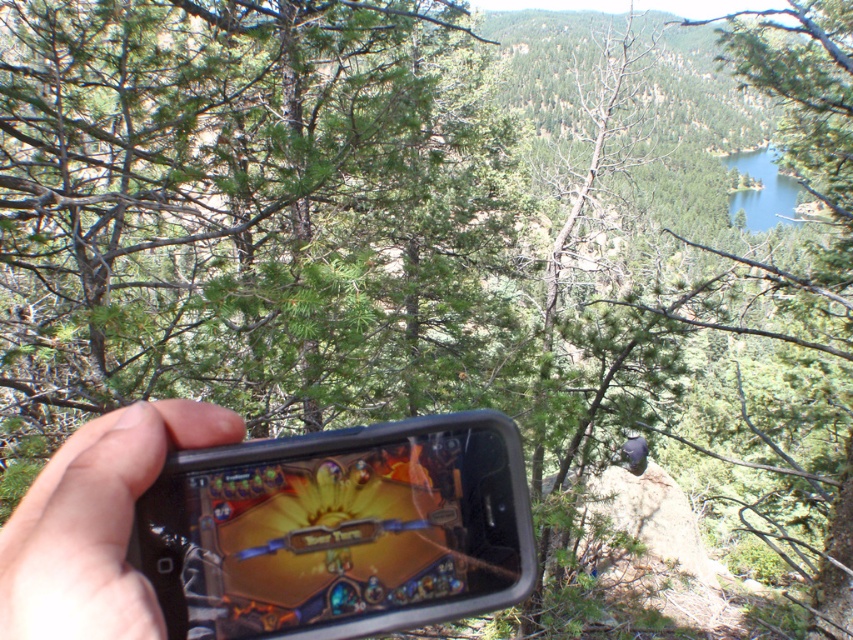
You are a photographer trying to capture the black plastic smartphone at center in your shot. Based on the scene, where should you aim your camera to ensure the smartphone is centered in the frame?

You should aim your camera at point [339,529] to center the black plastic smartphone at center in the frame.

You are a photographer trying to capture both the black plastic smartphone at center and the black matte phone at lower left in a single shot. Which phone should you focus on first to ensure both are in clear view?

You should focus on the black plastic smartphone at center first because it is closer to you than the black matte phone at lower left, ensuring both are in focus when using depth of field.